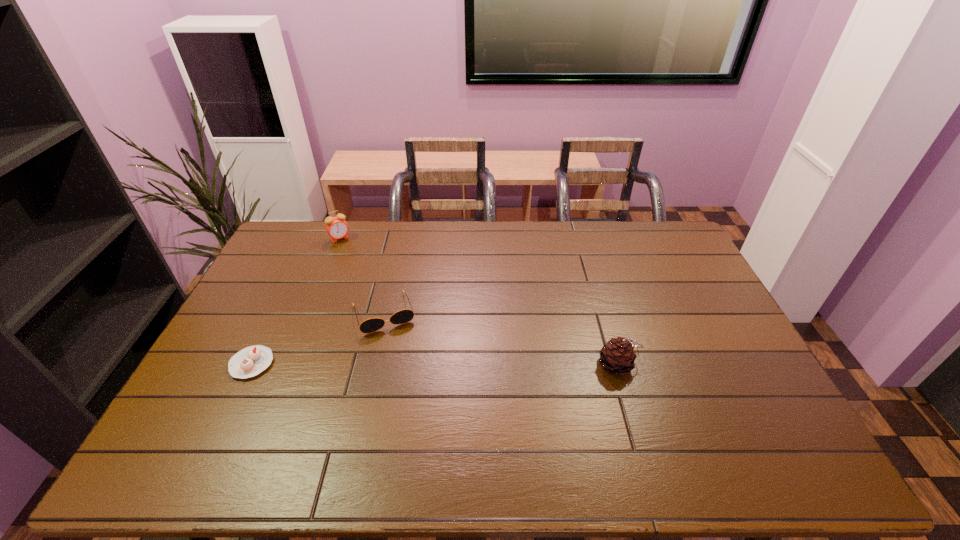
At what (x,y) coordinates should I click in order to perform the action: click on vacant space located 0.080m on the face of the alarm clock. Please return your answer as a coordinate pair (x, y). This screenshot has width=960, height=540. Looking at the image, I should click on (350, 254).

The height and width of the screenshot is (540, 960). What are the coordinates of `free point located 0.240m on the face of the alarm clock` in the screenshot? It's located at pos(367,278).

Locate an element on the screen. Image resolution: width=960 pixels, height=540 pixels. free location located 0.130m on the front-facing side of the third object from left to right is located at coordinates (402, 366).

Identify the location of free space located on the front-facing side of the third object from left to right. This screenshot has height=540, width=960. (423, 429).

Find the location of a particular element. The height and width of the screenshot is (540, 960). free space located on the front-facing side of the third object from left to right is located at coordinates (402, 366).

The width and height of the screenshot is (960, 540). What are the coordinates of `object that is at the far edge` in the screenshot? It's located at (337, 228).

At what (x,y) coordinates should I click in order to perform the action: click on object that is at the left edge. Please return your answer as a coordinate pair (x, y). This screenshot has height=540, width=960. Looking at the image, I should click on (250, 361).

Locate an element on the screen. Image resolution: width=960 pixels, height=540 pixels. vacant space at the far edge of the desktop is located at coordinates (516, 244).

Locate an element on the screen. This screenshot has width=960, height=540. free space at the near edge of the desktop is located at coordinates (593, 414).

You are a GUI agent. You are given a task and a screenshot of the screen. Output one action in this format:
    pyautogui.click(x=<x>, y=<y>)
    Task: Click on the vacant space at the left edge of the desktop
    
    Given the screenshot: What is the action you would take?
    pyautogui.click(x=224, y=383)